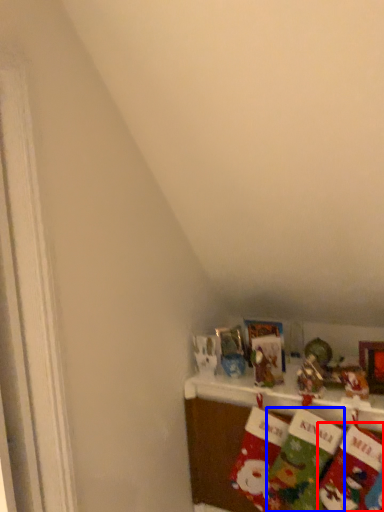
Question: Which point is further to the camera, sock (highlighted by a red box) or sock (highlighted by a blue box)?

Choices:
 (A) sock
 (B) sock

Answer: (B)